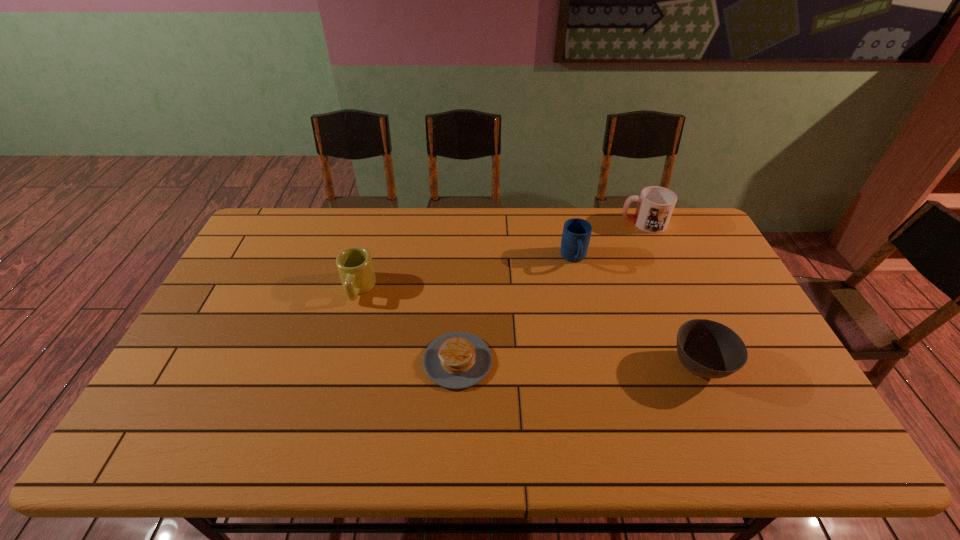
Image resolution: width=960 pixels, height=540 pixels. I want to click on vacant position in the image that satisfies the following two spatial constraints: 1. with the handle on the side of the leftmost object; 2. on the right side of the fourth object from right to left, so click(x=338, y=361).

Locate an element on the screen. The width and height of the screenshot is (960, 540). free location that satisfies the following two spatial constraints: 1. on the side of the farthest mug with the handle; 2. on the side of the third object from left to right with the handle is located at coordinates (659, 259).

Where is `free location that satisfies the following two spatial constraints: 1. on the side of the farthest mug with the handle; 2. on the front side of the bowl`? The height and width of the screenshot is (540, 960). free location that satisfies the following two spatial constraints: 1. on the side of the farthest mug with the handle; 2. on the front side of the bowl is located at coordinates (706, 367).